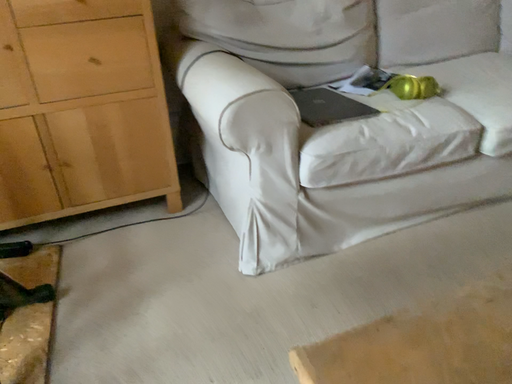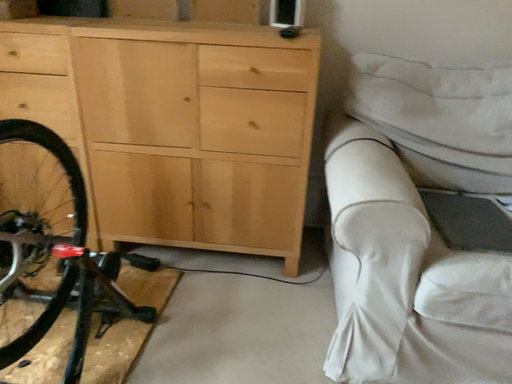
Question: Which way did the camera rotate in the video?

Choices:
 (A) rotated right
 (B) rotated left

Answer: (B)